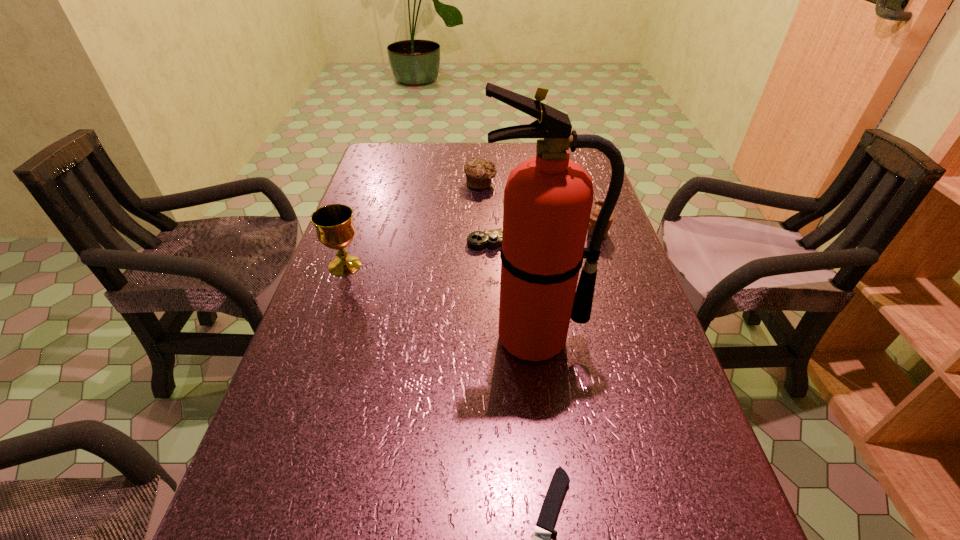
This screenshot has width=960, height=540. I want to click on vacant space located on the back of the chalice, so click(359, 227).

The image size is (960, 540). In order to click on vacant space located 0.090m on the left of the rightmost object in this screenshot , I will do `click(551, 232)`.

You are a GUI agent. You are given a task and a screenshot of the screen. Output one action in this format:
    pyautogui.click(x=<x>, y=<y>)
    Task: Click on the vacant space situated on the right of the shorter muffin
    
    Given the screenshot: What is the action you would take?
    pos(578,183)

Locate an element on the screen. The image size is (960, 540). vacant area located 0.120m on the right of the control is located at coordinates (573, 239).

Identify the location of object present at the far edge. Image resolution: width=960 pixels, height=540 pixels. (479, 173).

Where is `object positioned at the left edge`? The image size is (960, 540). object positioned at the left edge is located at coordinates (334, 225).

The width and height of the screenshot is (960, 540). Find the location of `fire extinguisher present at the right edge`. fire extinguisher present at the right edge is located at coordinates (548, 199).

Identify the location of muffin that is at the right edge. The width and height of the screenshot is (960, 540). (598, 204).

This screenshot has height=540, width=960. In order to click on free spot at the far edge of the desktop in this screenshot , I will do `click(526, 157)`.

Locate an element on the screen. Image resolution: width=960 pixels, height=540 pixels. vacant area at the left edge is located at coordinates (323, 392).